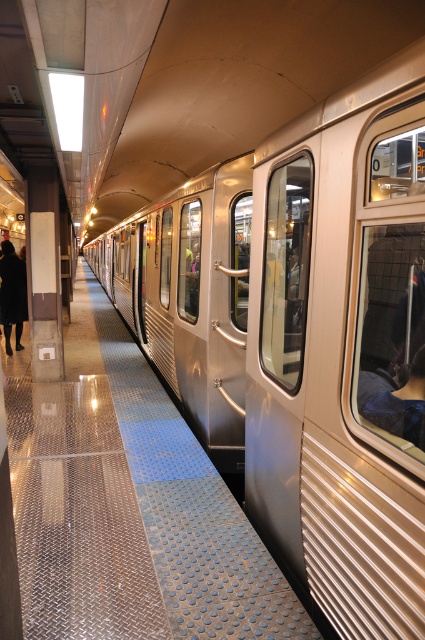
Question: Can you confirm if dark blue fabric at train right is positioned to the left of dark brown leather coat at left?

Choices:
 (A) no
 (B) yes

Answer: (A)

Question: Which point is farther to the camera?

Choices:
 (A) dark brown leather coat at left
 (B) dark blue fabric at train right

Answer: (A)

Question: Among these objects, which one is farthest from the camera?

Choices:
 (A) dark blue fabric at train right
 (B) dark brown leather coat at left

Answer: (B)

Question: Which of the following is the closest to the observer?

Choices:
 (A) dark blue fabric at train right
 (B) dark brown leather coat at left

Answer: (A)

Question: Does dark blue fabric at train right appear on the right side of dark brown leather coat at left?

Choices:
 (A) no
 (B) yes

Answer: (B)

Question: Does dark blue fabric at train right appear over dark brown leather coat at left?

Choices:
 (A) yes
 (B) no

Answer: (B)